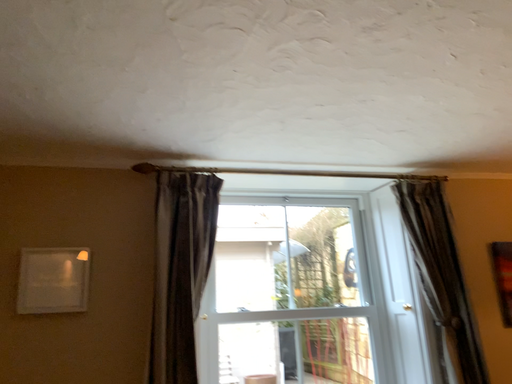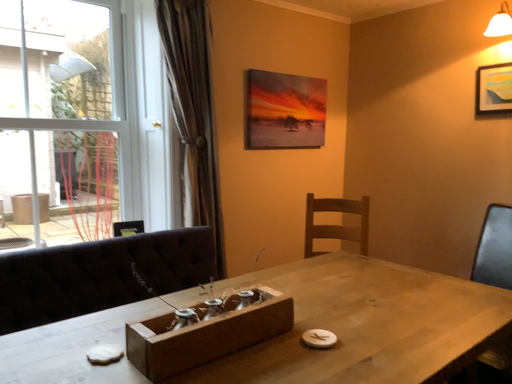
Question: Which way did the camera rotate in the video?

Choices:
 (A) rotated downward
 (B) rotated upward

Answer: (A)